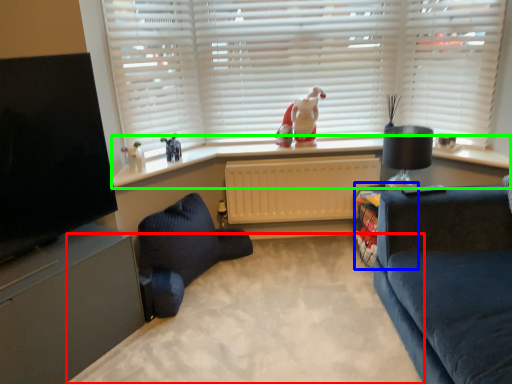
Question: Considering the real-world distances, which object is farthest from plain (highlighted by a red box)? table (highlighted by a blue box) or window sill (highlighted by a green box)?

Choices:
 (A) table
 (B) window sill

Answer: (B)